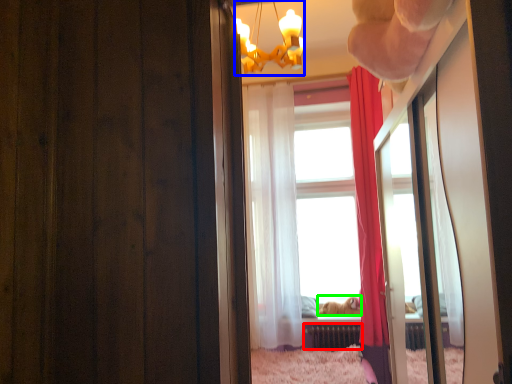
Question: Which is nearer to the radiator (highlighted by a red box)? lamp (highlighted by a blue box) or animal (highlighted by a green box).

Choices:
 (A) lamp
 (B) animal

Answer: (B)